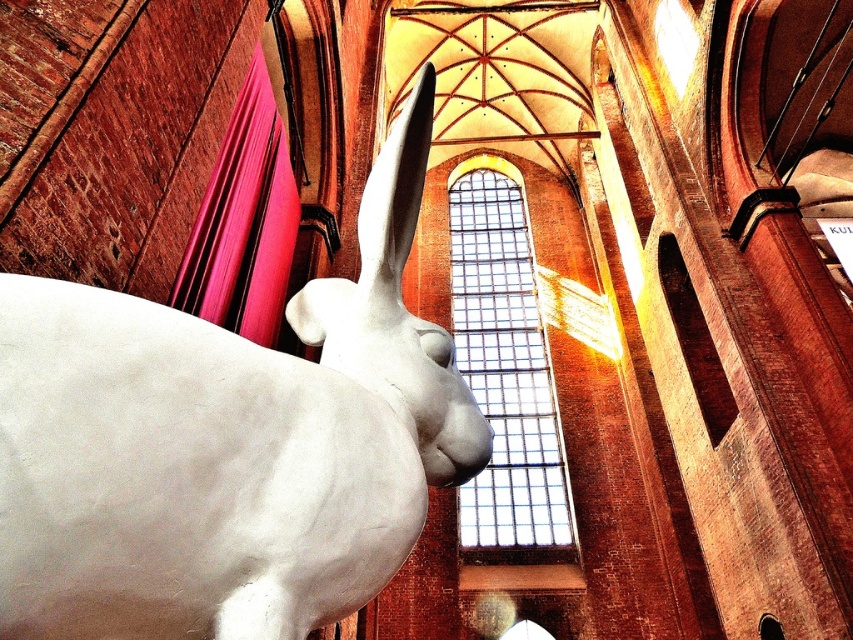
You are an art curator planning to move the white glossy sculpture at left and the matte pink fabric at left to a new exhibition space. To ensure proper placement, you need to know their relative positions. Which object is located to the right of the other?

The white glossy sculpture at left is positioned on the right side of matte pink fabric at left, so the sculpture is to the right of the fabric.

You are standing in the cathedral and want to move from the point at coordinates point (x=515, y=285) to the point at coordinates point (x=196, y=312). Which direction should you move to get closer to your destination?

To move from point (x=515, y=285) to point (x=196, y=312), you should move downward and to the right since the destination point is lower and further to the right compared to the starting point.

You are an architect designing a new lighting system for this historic building. You need to install a spotlight that can reach both the clear glass window at center and the matte pink fabric at left. What is the minimum distance the spotlight must cover to illuminate both areas?

The minimum distance the spotlight must cover is 53.40 meters to illuminate both the clear glass window at center and the matte pink fabric at left, as they are 53.40 meters apart.